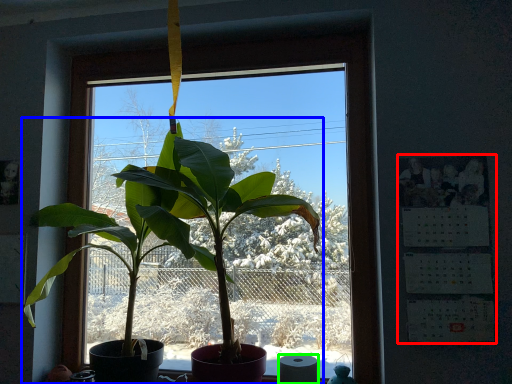
Question: Estimate the real-world distances between objects in this image. Which object is closer to bulletin board (highlighted by a red box), houseplant (highlighted by a blue box) or toilet paper (highlighted by a green box)?

Choices:
 (A) houseplant
 (B) toilet paper

Answer: (B)